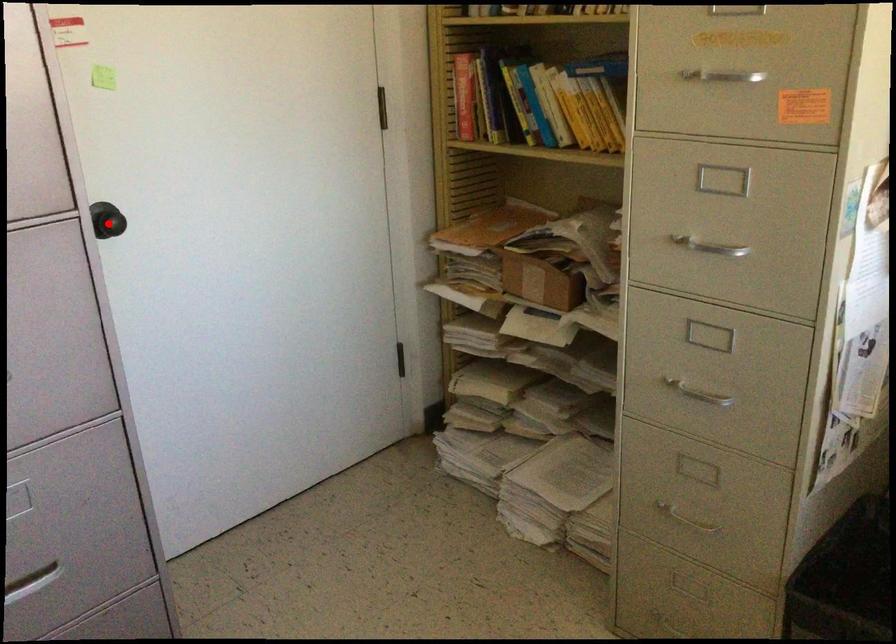
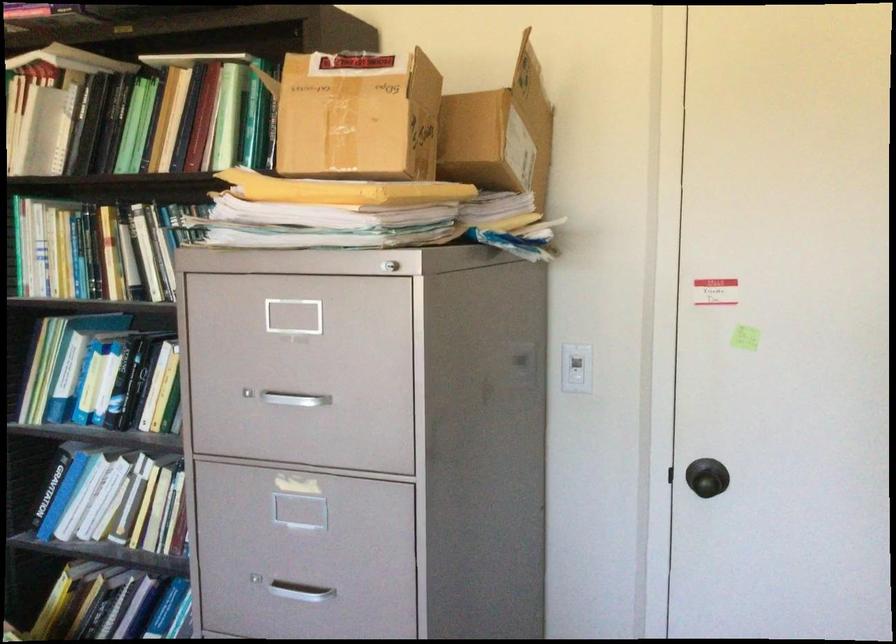
Where in the second image is the point corresponding to the highlighted location from the first image?

(707, 482)